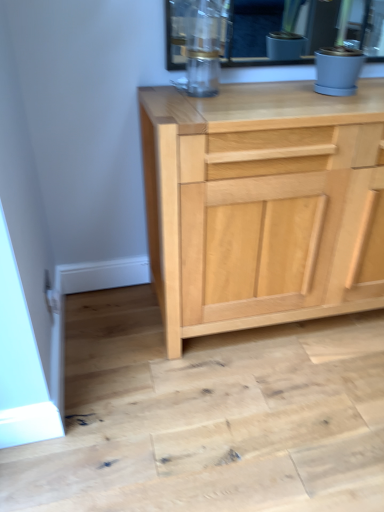
At what (x,y) coordinates should I click in order to perform the action: click on free space above natural wood cabinet at center (from a real-world perspective). Please return your answer as a coordinate pair (x, y). The height and width of the screenshot is (512, 384). Looking at the image, I should click on tap(278, 98).